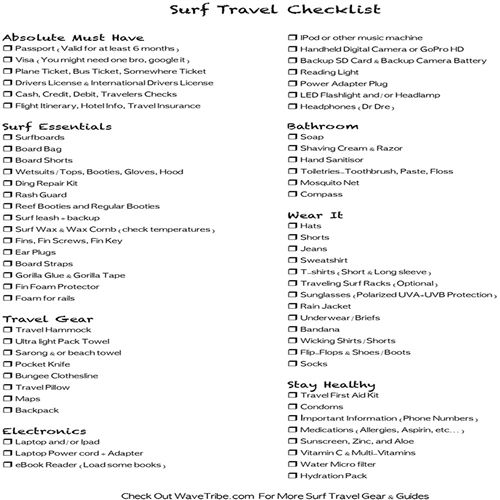
Identify the location of individual bathroom items. This screenshot has width=500, height=500. (316, 136), (333, 148), (344, 159), (372, 172), (412, 172), (441, 172), (333, 182), (324, 196), (387, 148).